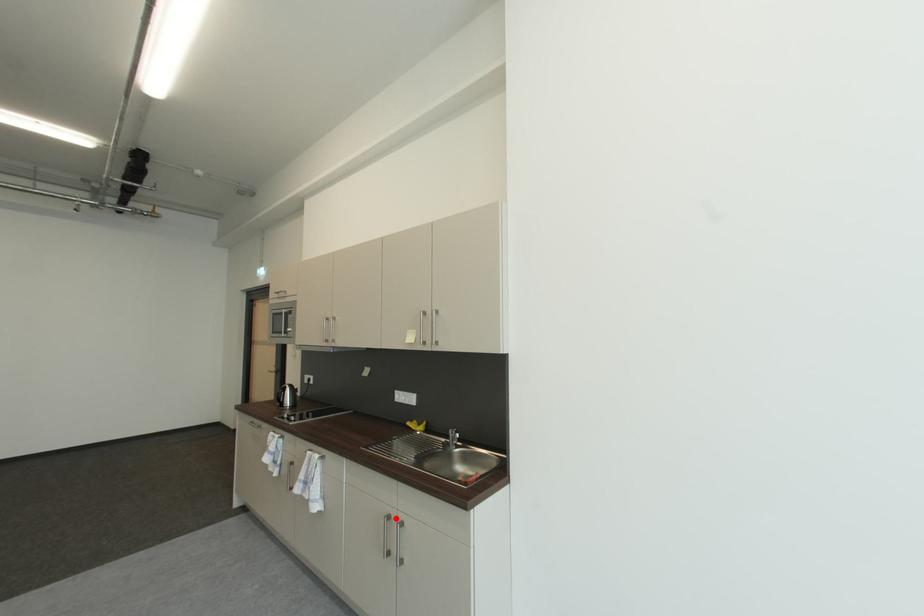
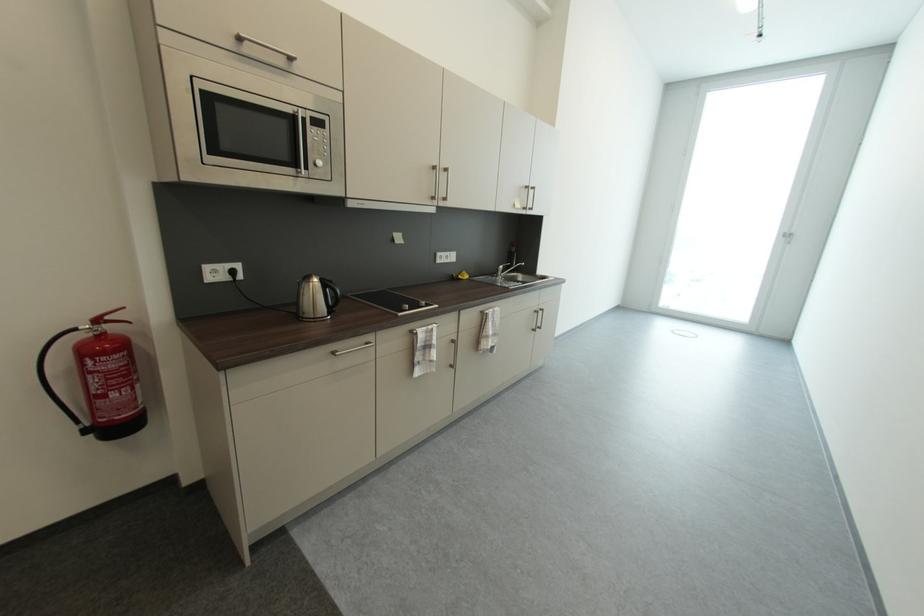
Question: I am providing you with two images of the same scene from different viewpoints. A red point is shown in image1. For the corresponding object point in image2, is it positioned nearer or farther from the camera?

Choices:
 (A) Nearer
 (B) Farther

Answer: (A)